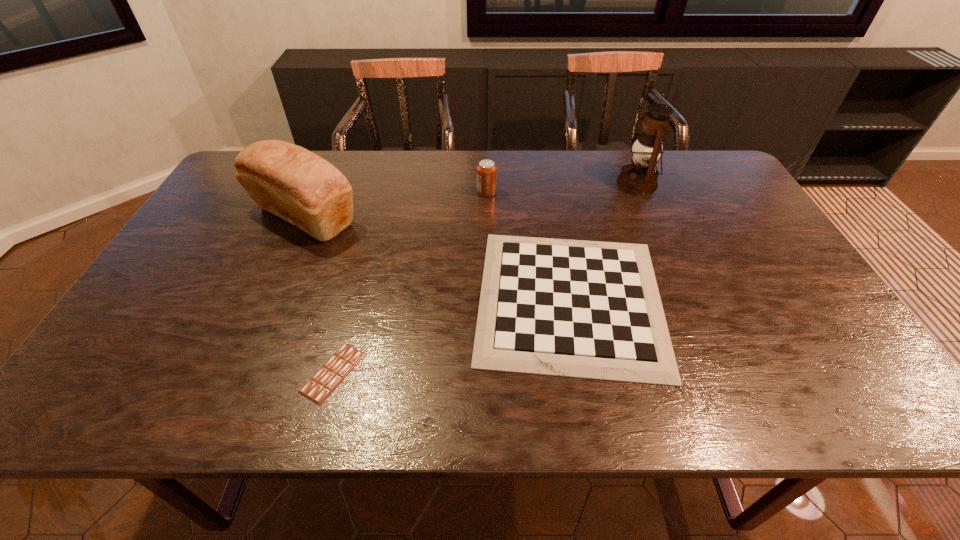
The width and height of the screenshot is (960, 540). I want to click on lantern, so click(x=640, y=177).

The height and width of the screenshot is (540, 960). What are the coordinates of `the second tallest object` in the screenshot? It's located at (287, 180).

Locate an element on the screen. The height and width of the screenshot is (540, 960). can is located at coordinates (486, 171).

Locate an element on the screen. Image resolution: width=960 pixels, height=540 pixels. the fourth tallest object is located at coordinates (572, 308).

The width and height of the screenshot is (960, 540). In order to click on chocolate bar in this screenshot , I will do `click(329, 376)`.

The height and width of the screenshot is (540, 960). Find the location of `vacant region located on the side of the lantern, there is a wick adjustment knob`. vacant region located on the side of the lantern, there is a wick adjustment knob is located at coordinates (508, 183).

The image size is (960, 540). What are the coordinates of `vacant space located 0.310m on the side of the lantern, there is a wick adjustment knob` in the screenshot? It's located at (520, 183).

Identify the location of vacant space located on the side of the lantern, there is a wick adjustment knob. The image size is (960, 540). (530, 183).

You are a GUI agent. You are given a task and a screenshot of the screen. Output one action in this format:
    pyautogui.click(x=<x>, y=<y>)
    Task: Click on the vacant position located 0.390m on the front of the bread
    
    Given the screenshot: What is the action you would take?
    pyautogui.click(x=234, y=375)

At what (x,y) coordinates should I click in order to perform the action: click on vacant space located on the right of the third shortest object. Please return your answer as a coordinate pair (x, y). Looking at the image, I should click on [621, 192].